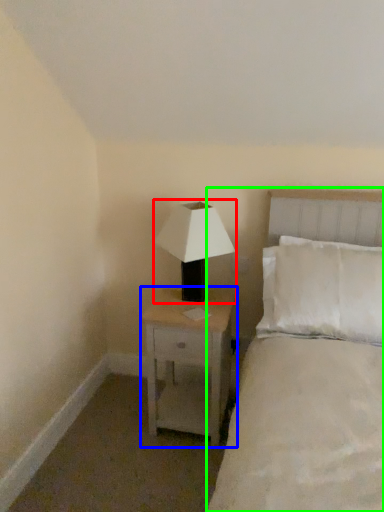
Question: Which is nearer to the lamp (highlighted by a red box)? nightstand (highlighted by a blue box) or bed (highlighted by a green box).

Choices:
 (A) nightstand
 (B) bed

Answer: (A)